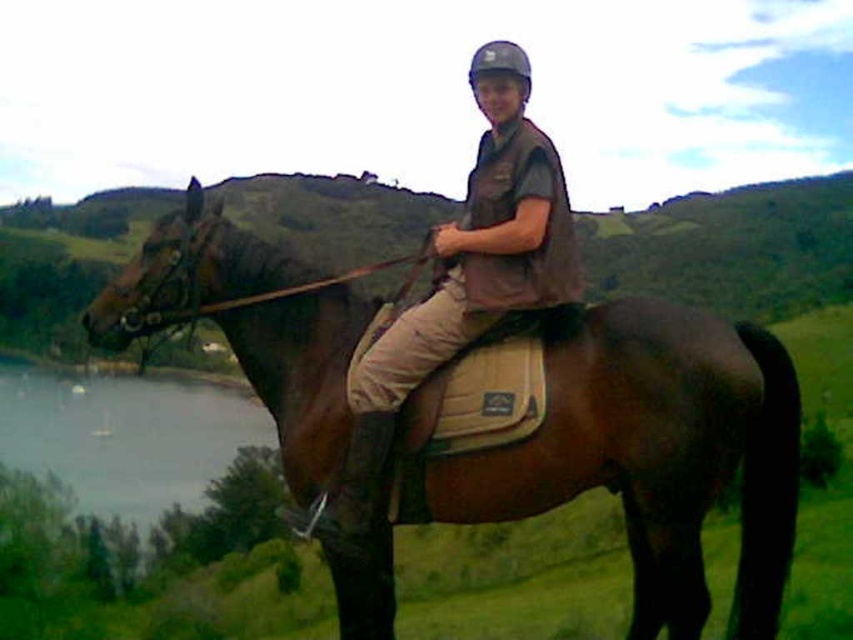
You are a photographer trying to capture the rider and the horse in a photo. You notice both the brown leather horse at center and the brown leather vest at center. Which object is positioned to the right side of the other?

The brown leather horse at center is to the right of the brown leather vest at center.

You are a horseback rider who wants to ensure safety while riding. You need to check the distance between the brown leather saddle at center and the horse. Is the distance safe for a secure riding position?

The distance between the brown leather saddle at center and the horse is 9.44 feet, which is not safe for a secure riding position as the saddle should be in direct contact with the horse for stability.